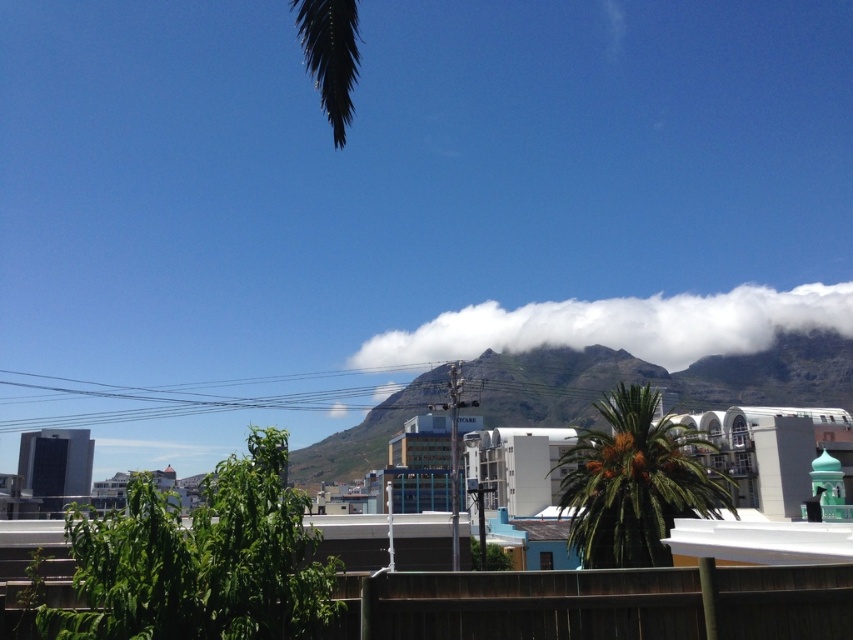
You are a bird flying over the urban landscape. You see a point at coordinates (619, 324). What is located at that point?

The point at coordinates (619, 324) is located on a white fluffy cloud at center.